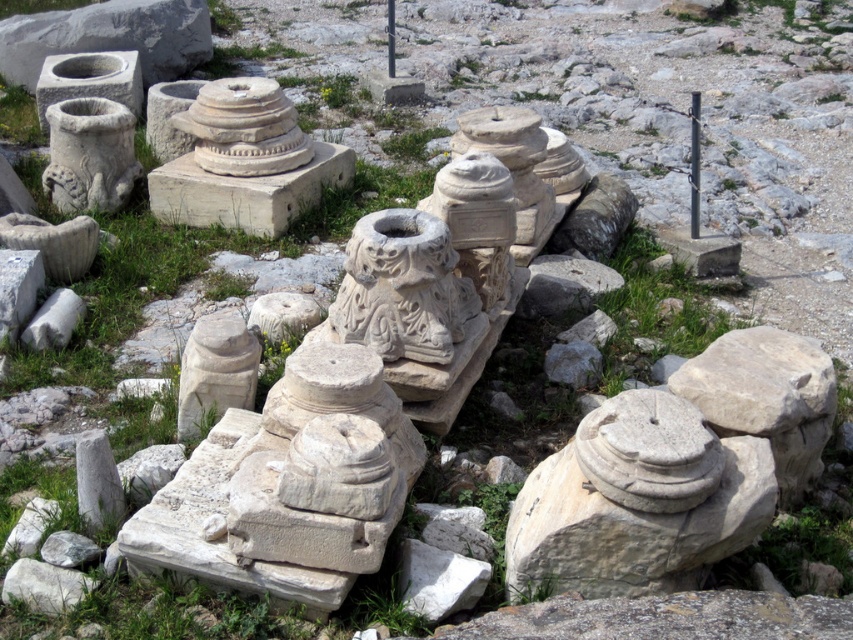
In the scene shown: You are an archaeologist standing at the edge of the archaeological site. You see the white stone sculpture at center and the white stone basin at upper left. Which object is closer to you?

The white stone sculpture at center is closer to you because it is in front of the white stone basin at upper left.

You are an archaeologist standing at the origin point of the site, which is at coordinates 0,0. You need to locate the white stone pillar at center. What are its coordinates?

The white stone pillar at center is located at coordinates (694, 163).